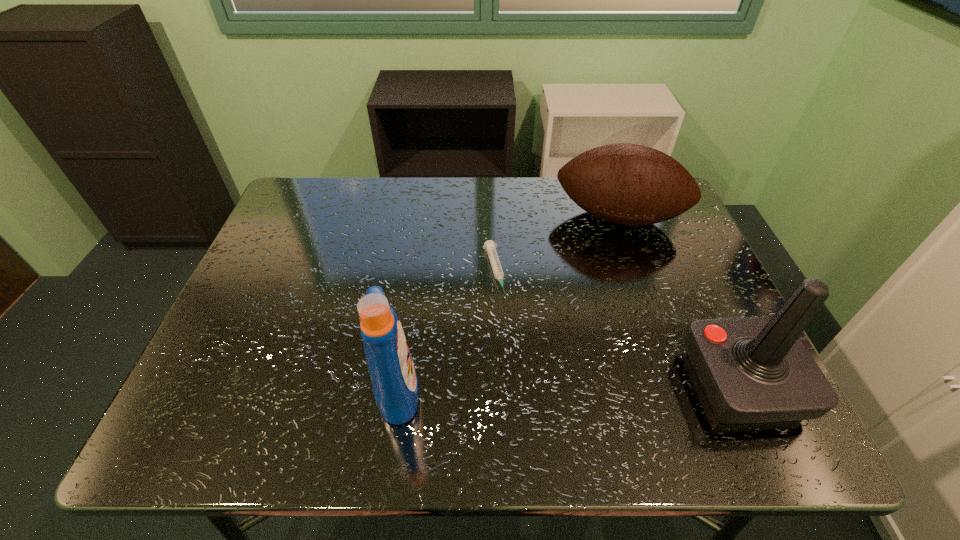
Where is `vacant area that lies between the farthest object and the leftmost object`? The height and width of the screenshot is (540, 960). vacant area that lies between the farthest object and the leftmost object is located at coordinates (508, 303).

Locate an element on the screen. free space between the shortest object and the joystick is located at coordinates (617, 328).

Identify the location of blank region between the joystick and the football. The width and height of the screenshot is (960, 540). (681, 300).

The image size is (960, 540). What are the coordinates of `unoccupied area between the farthest object and the second farthest object` in the screenshot? It's located at (556, 245).

At what (x,y) coordinates should I click in order to perform the action: click on free spot between the joystick and the shortest object. Please return your answer as a coordinate pair (x, y). The image size is (960, 540). Looking at the image, I should click on (617, 328).

Image resolution: width=960 pixels, height=540 pixels. I want to click on empty space that is in between the joystick and the detergent, so click(569, 386).

Find the location of a particular element. This screenshot has height=540, width=960. unoccupied area between the detergent and the shortest object is located at coordinates (445, 330).

This screenshot has width=960, height=540. Find the location of `object that stands as the third closest to the shortest object`. object that stands as the third closest to the shortest object is located at coordinates (752, 369).

Identify the location of object that is the second closest to the leftmost object. The height and width of the screenshot is (540, 960). (629, 184).

This screenshot has width=960, height=540. Identify the location of vacant space that satisfies the following two spatial constraints: 1. on the front side of the second object from left to right; 2. on the right side of the joystick. (497, 383).